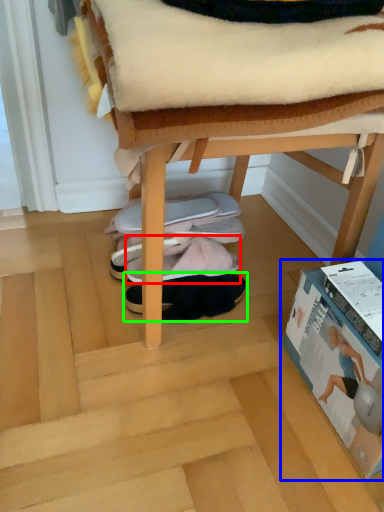
Question: Which is farther away from footwear (highlighted by a red box)? paperback book (highlighted by a blue box) or footwear (highlighted by a green box)?

Choices:
 (A) paperback book
 (B) footwear

Answer: (A)